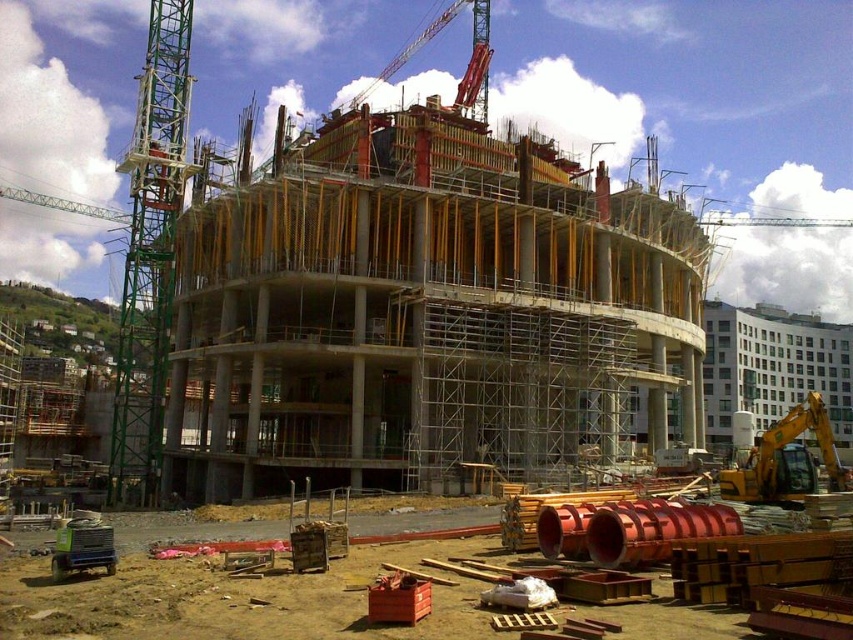
Is yellow metallic excavator at lower right taller than green plastic generator at lower left?

Indeed, yellow metallic excavator at lower right has a greater height compared to green plastic generator at lower left.

Between yellow metallic excavator at lower right and green plastic generator at lower left, which one has less height?

With less height is green plastic generator at lower left.

Who is more distant from viewer, (x=727, y=481) or (x=105, y=525)?

The point (x=727, y=481) is behind.

Where is `yellow metallic excavator at lower right`? yellow metallic excavator at lower right is located at coordinates (786, 460).

Is green plastic generator at lower left below metallic red crane at upper center?

Yes, green plastic generator at lower left is below metallic red crane at upper center.

Does green plastic generator at lower left appear on the left side of metallic red crane at upper center?

Correct, you'll find green plastic generator at lower left to the left of metallic red crane at upper center.

What do you see at coordinates (83, 545) in the screenshot?
I see `green plastic generator at lower left` at bounding box center [83, 545].

Identify the location of green plastic generator at lower left. (83, 545).

Is silver metallic scaffolding at center further to the viewer compared to yellow metallic excavator at lower right?

Yes, silver metallic scaffolding at center is further from the viewer.

Does silver metallic scaffolding at center have a lesser width compared to yellow metallic excavator at lower right?

Correct, silver metallic scaffolding at center's width is less than yellow metallic excavator at lower right's.

Which is in front, point (567, 465) or point (822, 432)?

Point (822, 432) is more forward.

The image size is (853, 640). I want to click on silver metallic scaffolding at center, so click(x=511, y=392).